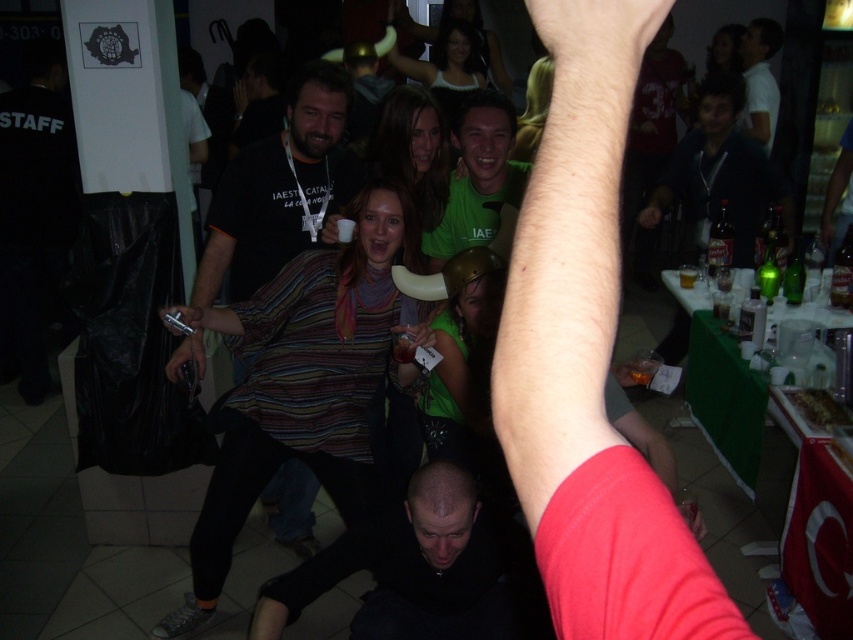
You are at a party and want to take a photo of the dark blue hoodie at upper right and the white matte shirt at upper right. Which one is shorter in height?

The dark blue hoodie at upper right has a lesser height compared to white matte shirt at upper right, so the dark blue hoodie at upper right is shorter in height.

You are at a party and want to take a photo of the dark blue hoodie at upper right and the green matte shirt at center. Which one should you zoom in on to capture more details?

The dark blue hoodie at upper right is larger in width than the green matte shirt at center, so you should zoom in on the green matte shirt at center to capture more details.